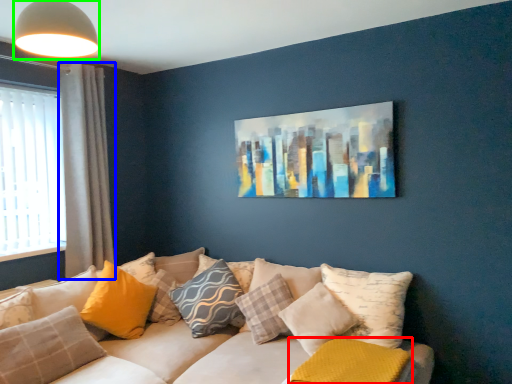
Question: Which object is positioned closest to pillow (highlighted by a red box)? Select from curtain (highlighted by a blue box) and light fixture (highlighted by a green box).

Choices:
 (A) curtain
 (B) light fixture

Answer: (B)